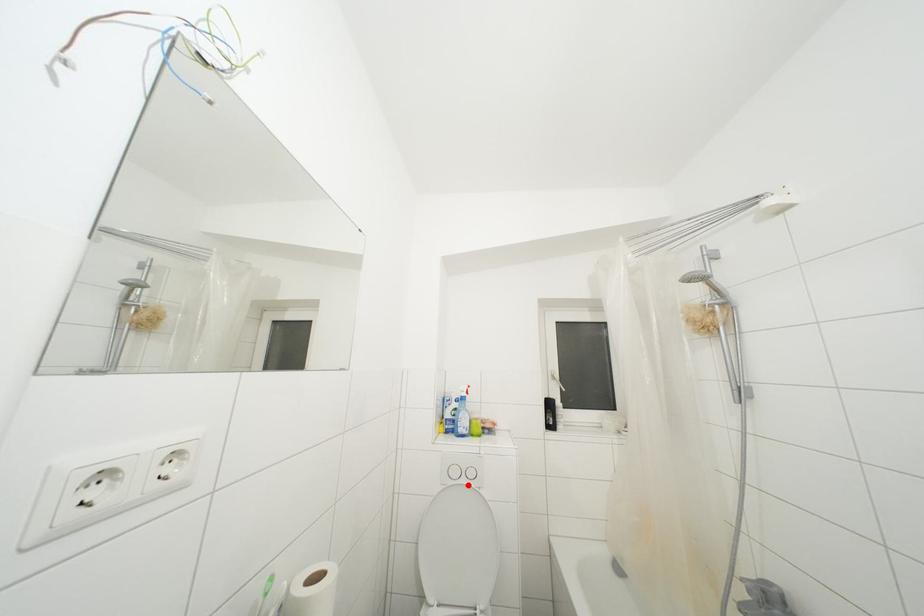
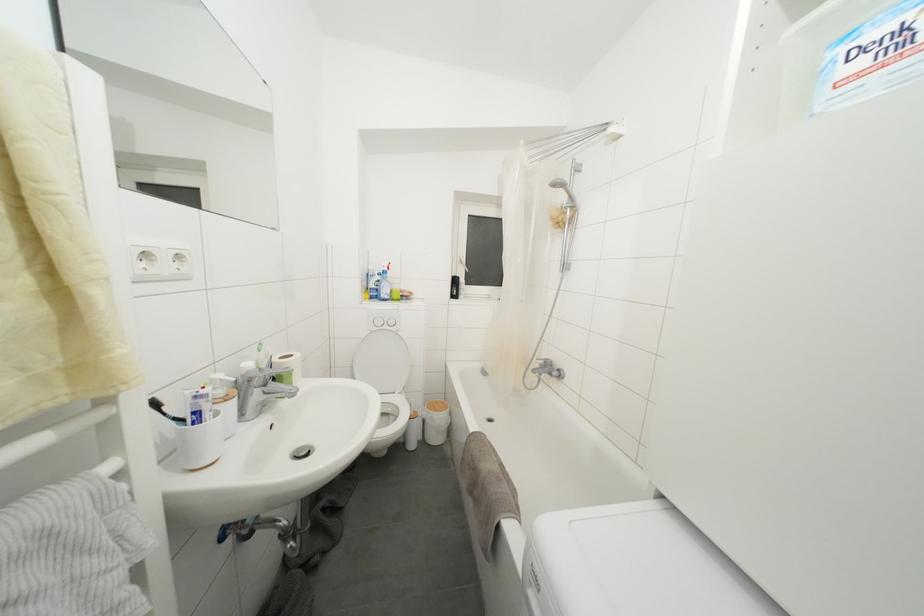
The point at the highlighted location is marked in the first image. Where is the corresponding point in the second image?

(390, 331)